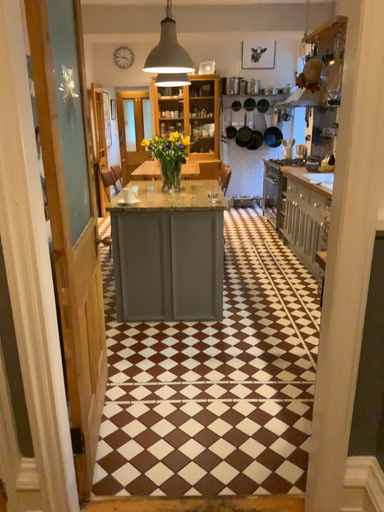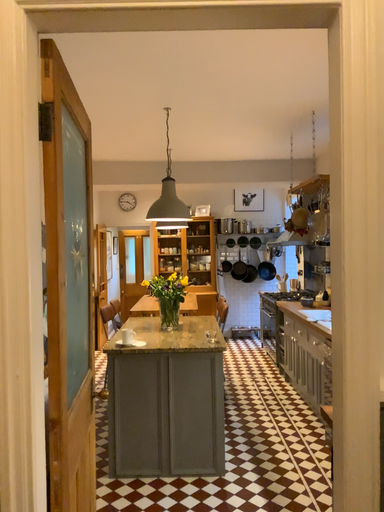
Question: Which way did the camera rotate in the video?

Choices:
 (A) rotated upward
 (B) rotated downward

Answer: (A)